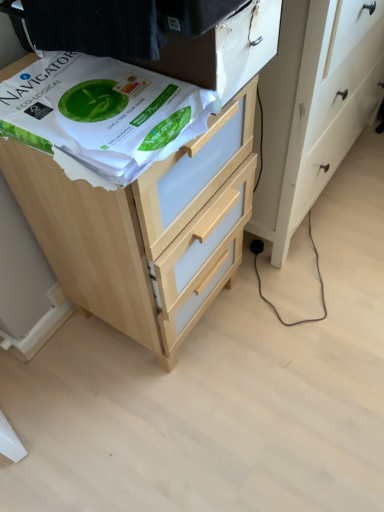
The width and height of the screenshot is (384, 512). Find the location of `vacant space that is to the left of light wood chest of drawers at upper center`. vacant space that is to the left of light wood chest of drawers at upper center is located at coordinates (59, 359).